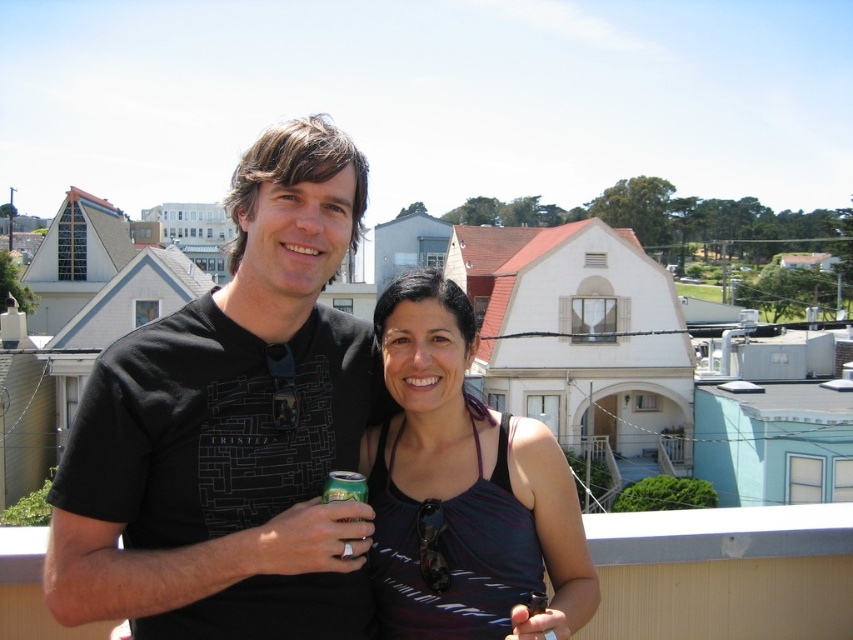
You are standing on a balcony and want to hand the green metallic can at center to the person wearing the matte black tank top at center. Which direction should you move the can to reach them?

The matte black tank top at center is to the right of the green metallic can at center, so you should move the can to the right to reach the person wearing the matte black tank top at center.